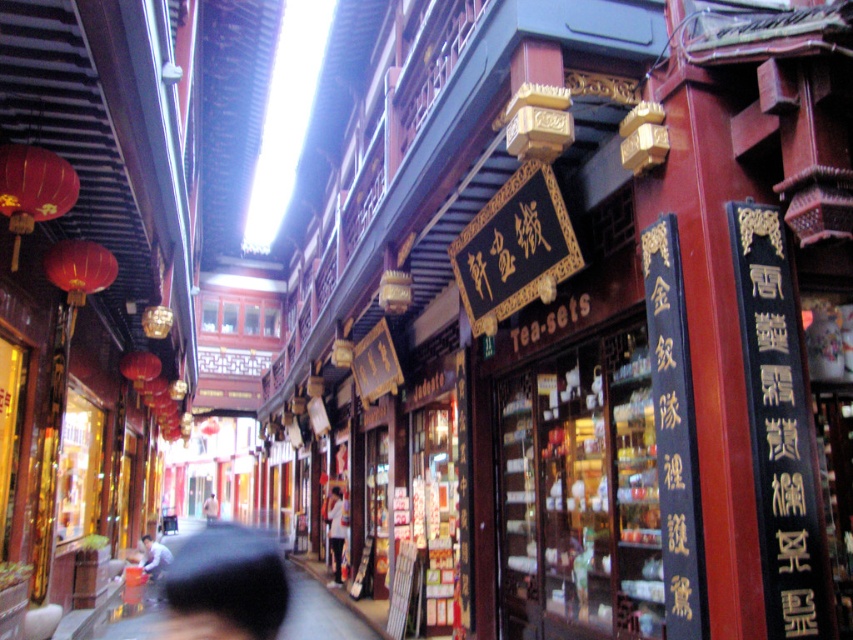
Between point (769, 365) and point (212, 504), which one is positioned in front?

Point (769, 365) is more forward.

Does point (785, 452) come behind point (206, 502)?

No, (785, 452) is closer to viewer.

Image resolution: width=853 pixels, height=640 pixels. Identify the location of black wood sign at right. (780, 449).

Is black wood sign at right closer to the viewer compared to dark gray fabric umbrella at lower center?

That is True.

Image resolution: width=853 pixels, height=640 pixels. In order to click on black wood sign at right in this screenshot , I will do `click(780, 449)`.

Image resolution: width=853 pixels, height=640 pixels. Describe the element at coordinates (780, 449) in the screenshot. I see `black wood sign at right` at that location.

Identify the location of black wood sign at right. The width and height of the screenshot is (853, 640). (780, 449).

Looking at this image, does dark gray fabric umbrella at lower center have a greater height compared to white cotton shirt at center?

Yes.

Is point (181, 628) less distant than point (209, 516)?

Yes.

At what (x,y) coordinates should I click in order to perform the action: click on dark gray fabric umbrella at lower center. Please return your answer as a coordinate pair (x, y). Looking at the image, I should click on (225, 586).